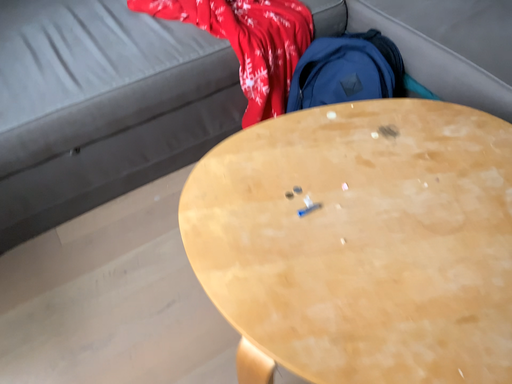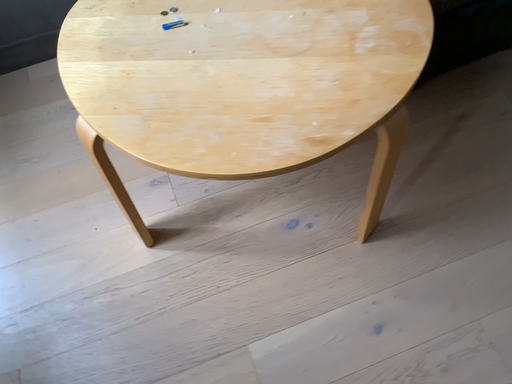
Question: How did the camera likely rotate when shooting the video?

Choices:
 (A) rotated left
 (B) rotated right

Answer: (A)